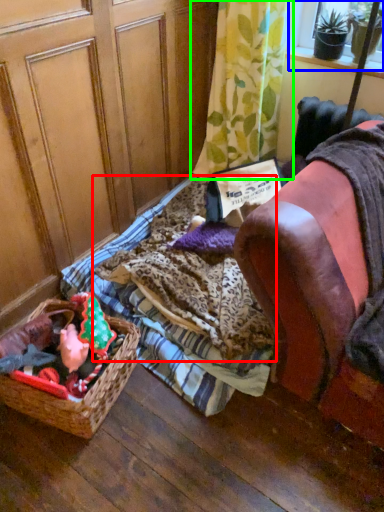
Question: Based on their relative distances, which object is nearer to blanket (highlighted by a red box)? Choose from window screen (highlighted by a blue box) and curtain (highlighted by a green box).

Choices:
 (A) window screen
 (B) curtain

Answer: (B)